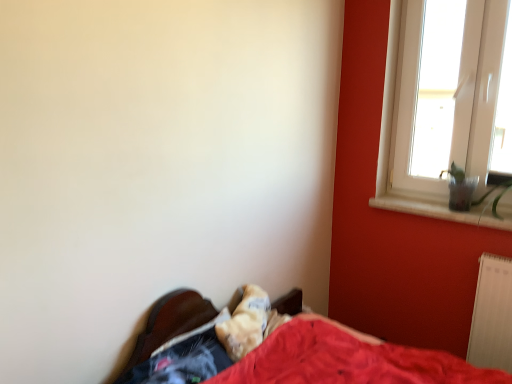
Question: Should I look upward or downward to see white marble window sill at right?

Choices:
 (A) down
 (B) up

Answer: (A)